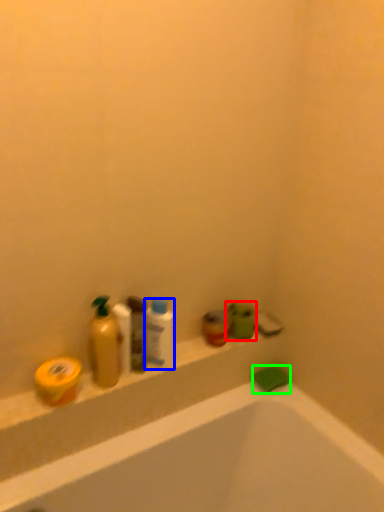
Question: Estimate the real-world distances between objects in this image. Which object is closer to toiletry (highlighted by a red box), mouthwash (highlighted by a blue box) or soap (highlighted by a green box)?

Choices:
 (A) mouthwash
 (B) soap

Answer: (B)